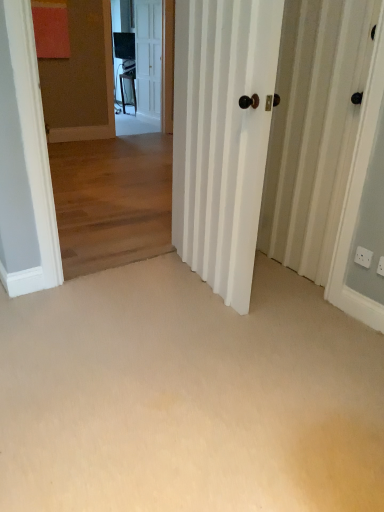
You are a GUI agent. You are given a task and a screenshot of the screen. Output one action in this format:
    pyautogui.click(x=<x>, y=<y>)
    Task: Click on the free spot to the left of white glossy door at center, the second door positioned from the back
    
    Given the screenshot: What is the action you would take?
    pyautogui.click(x=125, y=291)